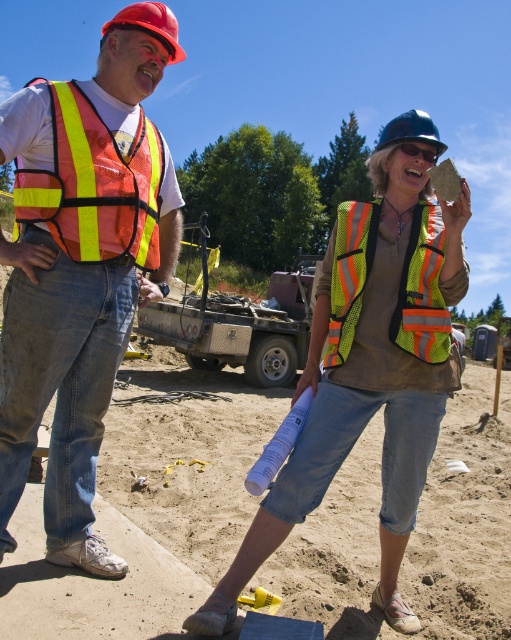
Is point (30, 429) closer to viewer compared to point (386, 154)?

Yes, point (30, 429) is in front of point (386, 154).

Who is more distant from viewer, (40, 273) or (364, 243)?

Point (364, 243)

The width and height of the screenshot is (511, 640). I want to click on reflective orange safety vest at left, so click(81, 266).

Which of these two, hard hat at center or transparent plastic goggles at center, stands taller?

hard hat at center is taller.

From the picture: Can you confirm if hard hat at center is positioned above transparent plastic goggles at center?

Indeed, hard hat at center is positioned over transparent plastic goggles at center.

Does point (406, 113) lie in front of point (431, 156)?

No, (406, 113) is behind (431, 156).

At what (x,y) coordinates should I click in order to perform the action: click on hard hat at center. Please return your answer as a coordinate pair (x, y). Looking at the image, I should click on (410, 131).

Does neon reflective safety vest at center have a larger size compared to transparent plastic goggles at center?

Yes, neon reflective safety vest at center is bigger than transparent plastic goggles at center.

Is point (404, 330) closer to camera compared to point (419, 147)?

That is True.

Where is `neon reflective safety vest at center`? The height and width of the screenshot is (640, 511). neon reflective safety vest at center is located at coordinates (423, 291).